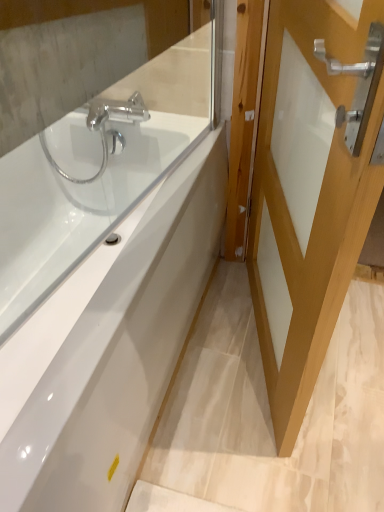
What are the coordinates of `vacant space in front of white glossy door at right` in the screenshot? It's located at (269, 440).